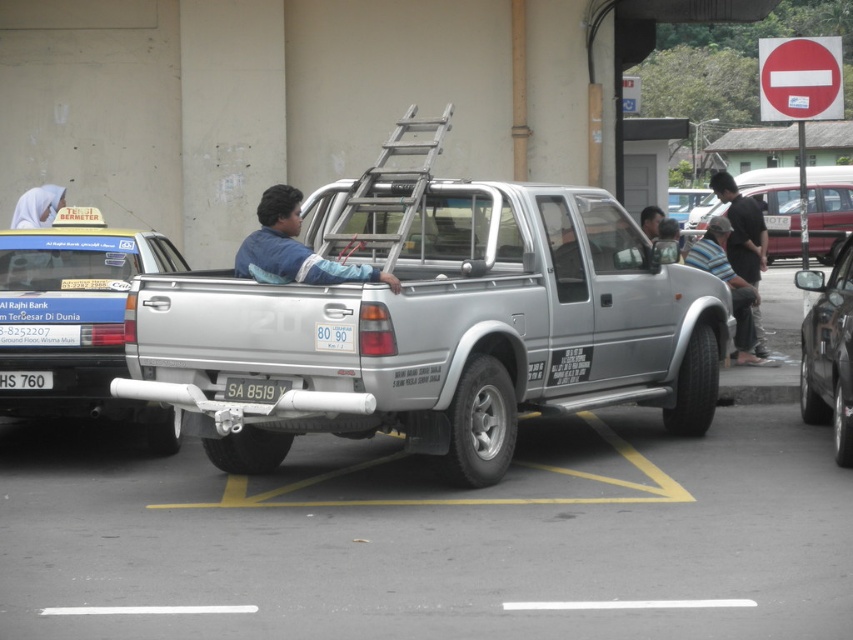
Which is behind, point (834, 182) or point (271, 380)?

Positioned behind is point (834, 182).

Does metallic red pickup truck at center appear on the left side of white plastic license plate at center?

Incorrect, metallic red pickup truck at center is not on the left side of white plastic license plate at center.

Describe the element at coordinates (828, 218) in the screenshot. I see `metallic red pickup truck at center` at that location.

The width and height of the screenshot is (853, 640). What are the coordinates of `metallic red pickup truck at center` in the screenshot? It's located at (828, 218).

Is the position of silver metallic pickup truck at center less distant than that of metallic silver car at right?

Yes, silver metallic pickup truck at center is closer to the viewer.

Does silver metallic pickup truck at center appear under metallic silver car at right?

Incorrect, silver metallic pickup truck at center is not positioned below metallic silver car at right.

Between point (399, 216) and point (817, 371), which one is positioned behind?

Point (817, 371)

Find the location of `silver metallic pickup truck at center`. silver metallic pickup truck at center is located at coordinates (436, 324).

Image resolution: width=853 pixels, height=640 pixels. Describe the element at coordinates (828, 353) in the screenshot. I see `metallic silver car at right` at that location.

Does metallic silver car at right have a smaller size compared to white fabric headscarf at upper left?

No.

Does point (807, 289) come closer to viewer compared to point (13, 212)?

Yes, it is in front of point (13, 212).

I want to click on metallic silver car at right, so click(x=828, y=353).